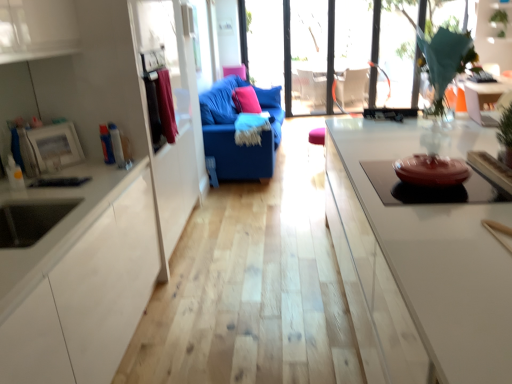
Question: Is velvet blue sofa at center positioned behind transparent glass door at center?

Choices:
 (A) yes
 (B) no

Answer: (B)

Question: From a real-world perspective, is velvet blue sofa at center beneath transparent glass door at center?

Choices:
 (A) no
 (B) yes

Answer: (B)

Question: Is velvet blue sofa at center not near transparent glass door at center?

Choices:
 (A) no
 (B) yes

Answer: (B)

Question: Is velvet blue sofa at center closer to the viewer compared to transparent glass door at center?

Choices:
 (A) no
 (B) yes

Answer: (B)

Question: Is transparent glass door at center at the back of velvet blue sofa at center?

Choices:
 (A) no
 (B) yes

Answer: (A)

Question: Is velvet blue sofa at center facing towards transparent glass door at center?

Choices:
 (A) yes
 (B) no

Answer: (B)

Question: Is pink fabric pillow at center, placed as the 2th pillow when sorted from front to back, located outside pink fabric pillow at center, the 2th pillow when ordered from back to front?

Choices:
 (A) yes
 (B) no

Answer: (A)

Question: From the image's perspective, is pink fabric pillow at center, placed as the 2th pillow when sorted from front to back, below pink fabric pillow at center, which appears as the 1th pillow when viewed from the front?

Choices:
 (A) no
 (B) yes

Answer: (A)

Question: From a real-world perspective, is pink fabric pillow at center, the 1th pillow when ordered from back to front, over pink fabric pillow at center, which appears as the 1th pillow when viewed from the front?

Choices:
 (A) yes
 (B) no

Answer: (A)

Question: Does pink fabric pillow at center, placed as the 2th pillow when sorted from front to back, have a greater height compared to pink fabric pillow at center, which appears as the 1th pillow when viewed from the front?

Choices:
 (A) no
 (B) yes

Answer: (B)

Question: Can you confirm if pink fabric pillow at center, placed as the 2th pillow when sorted from front to back, is smaller than pink fabric pillow at center, which appears as the 1th pillow when viewed from the front?

Choices:
 (A) no
 (B) yes

Answer: (A)

Question: Is pink fabric pillow at center, placed as the 2th pillow when sorted from front to back, facing towards pink fabric pillow at center, the 2th pillow when ordered from back to front?

Choices:
 (A) yes
 (B) no

Answer: (A)

Question: Is transparent glass window at upper center, positioned as the first window in left-to-right order, placed right next to white glossy table at upper right?

Choices:
 (A) yes
 (B) no

Answer: (B)